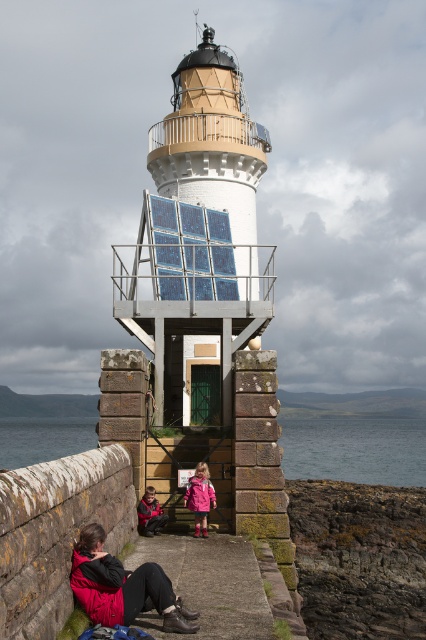
Question: Can you confirm if pink matte jacket at lower center is bigger than matte black jacket at lower left?

Choices:
 (A) no
 (B) yes

Answer: (B)

Question: Estimate the real-world distances between objects in this image. Which object is closer to the matte black jacket at lower left?

Choices:
 (A) pink matte jacket at lower center
 (B) matte pink jacket at lower left

Answer: (A)

Question: Does blue water at lower center have a smaller size compared to matte black jacket at lower left?

Choices:
 (A) no
 (B) yes

Answer: (A)

Question: Which of the following is the farthest from the observer?

Choices:
 (A) pink matte jacket at lower center
 (B) matte black jacket at lower left
 (C) matte pink jacket at lower left
 (D) blue water at lower center

Answer: (D)

Question: Is pink matte jacket at lower center to the right of matte black jacket at lower left from the viewer's perspective?

Choices:
 (A) no
 (B) yes

Answer: (B)

Question: Considering the real-world distances, which object is closest to the pink matte jacket at lower center?

Choices:
 (A) blue water at lower center
 (B) matte black jacket at lower left
 (C) matte pink jacket at lower left

Answer: (B)